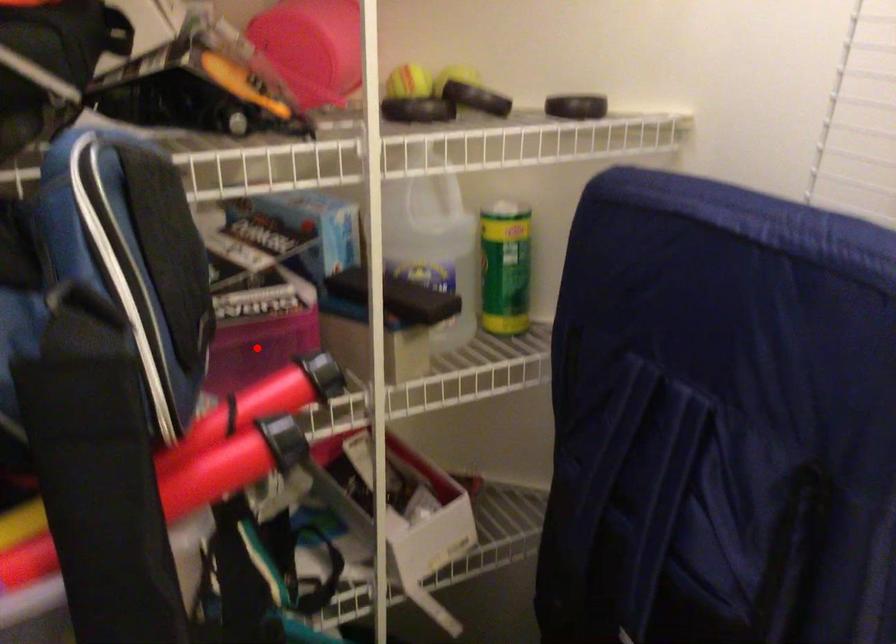
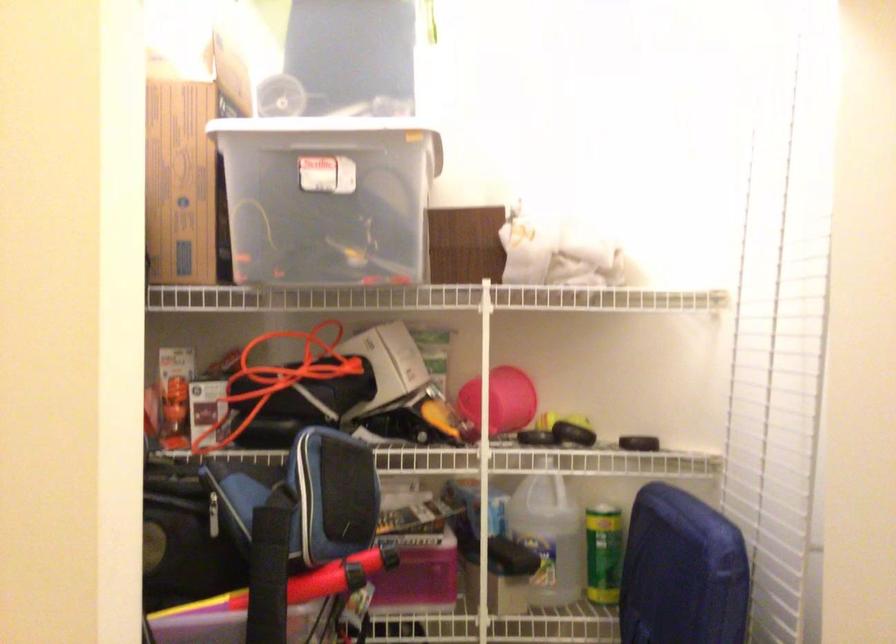
Question: I am providing you with two images of the same scene from different viewpoints. In image1, a red point is highlighted. Considering the same 3D point in image2, which of the following is correct?

Choices:
 (A) It is closer
 (B) It is farther

Answer: (B)